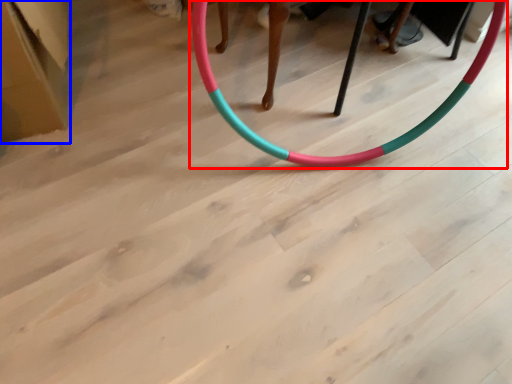
Question: Which of the following is the farthest to the observer, toy (highlighted by a red box) or cardboard box (highlighted by a blue box)?

Choices:
 (A) toy
 (B) cardboard box

Answer: (B)